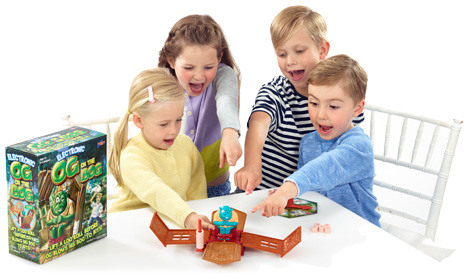
What are the coordinates of `chair` in the screenshot? It's located at (436, 210), (105, 120).